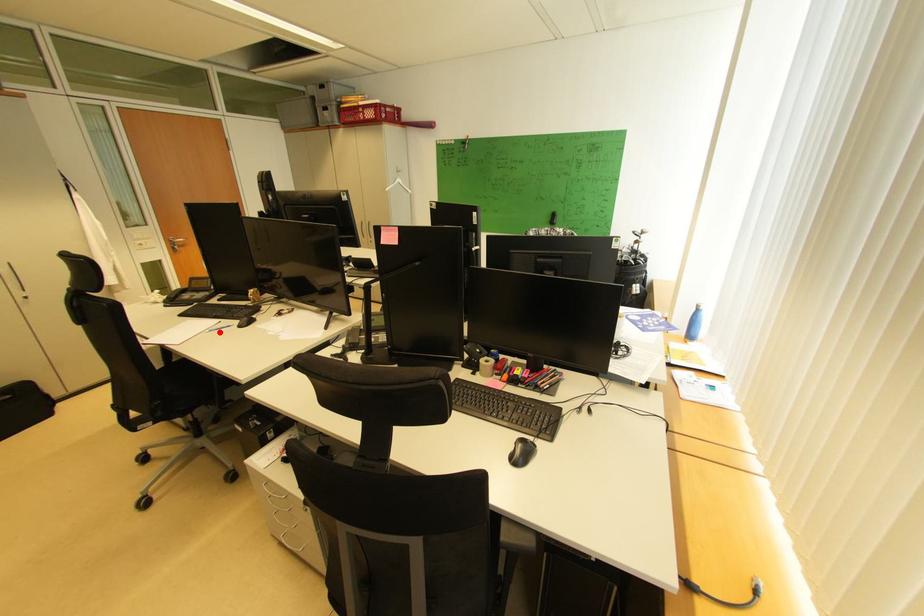
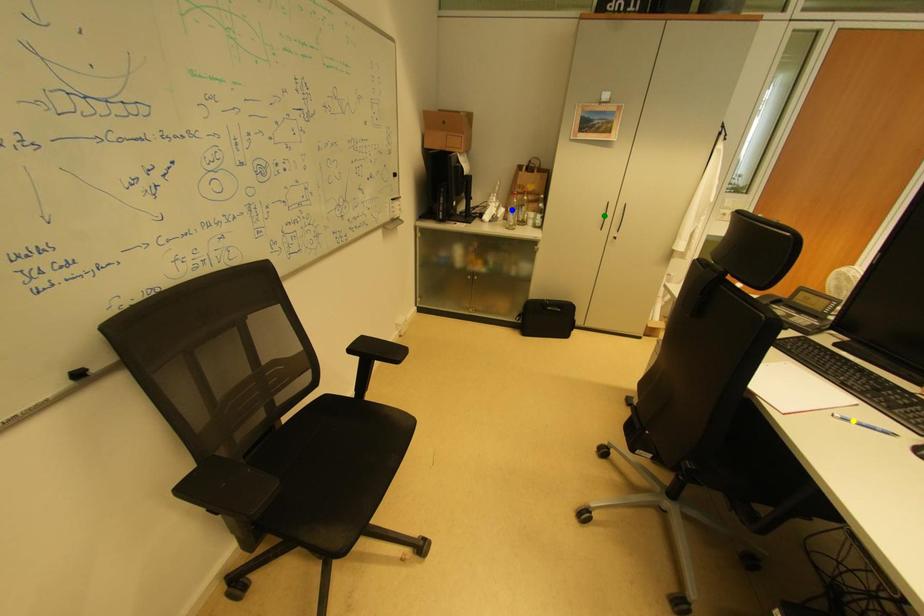
Question: I am providing you with two images of the same scene from different viewpoints. A red point is marked on the first image. You are given multiple points on the second image. Which point in image 2 represents the same 3d spot as the red point in image 1?

Choices:
 (A) blue point
 (B) green point
 (C) yellow point

Answer: (C)